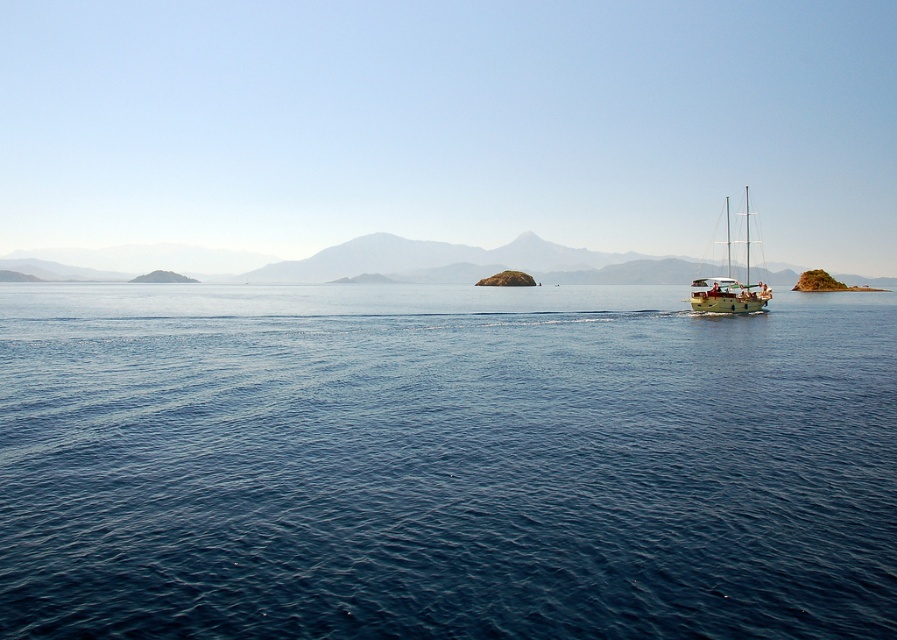
Question: Is blue water at center positioned before wooden sailboat at right?

Choices:
 (A) yes
 (B) no

Answer: (A)

Question: Which object appears closest to the camera in this image?

Choices:
 (A) wooden sailboat at right
 (B) blue water at center
 (C) rocky brown mountain at center

Answer: (B)

Question: Which point is farther from the camera taking this photo?

Choices:
 (A) (319, 468)
 (B) (528, 266)
 (C) (727, 220)

Answer: (B)

Question: Estimate the real-world distances between objects in this image. Which object is closer to the wooden sailboat at right?

Choices:
 (A) blue water at center
 (B) rocky brown mountain at center

Answer: (A)

Question: Does blue water at center have a lesser width compared to rocky brown mountain at center?

Choices:
 (A) no
 (B) yes

Answer: (B)

Question: Is blue water at center to the left of rocky brown mountain at center from the viewer's perspective?

Choices:
 (A) yes
 (B) no

Answer: (B)